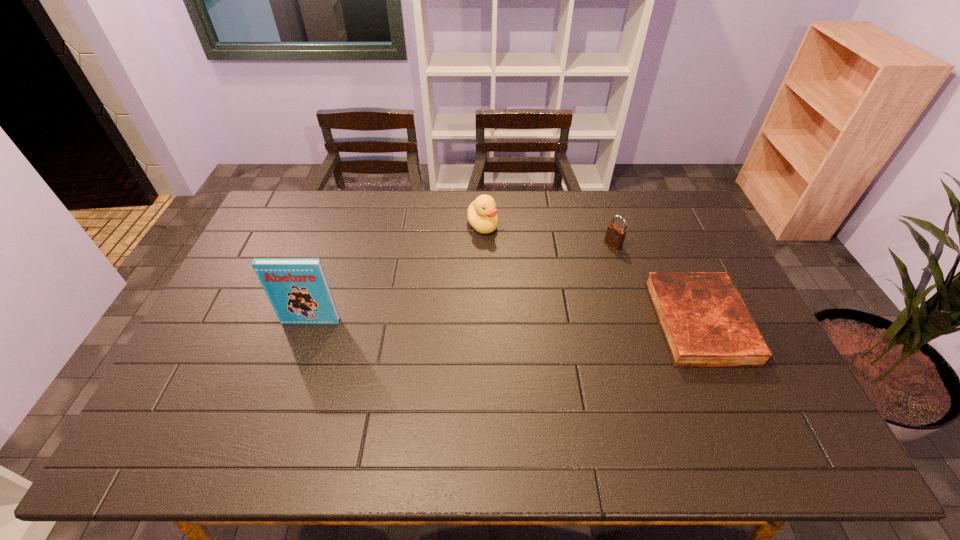
The height and width of the screenshot is (540, 960). I want to click on the leftmost object, so click(297, 288).

Locate an element on the screen. The image size is (960, 540). book is located at coordinates (297, 288).

Where is `the shortest object`? This screenshot has width=960, height=540. the shortest object is located at coordinates (705, 322).

Locate an element on the screen. the rightmost object is located at coordinates (705, 322).

Locate an element on the screen. duck is located at coordinates (482, 214).

You are a GUI agent. You are given a task and a screenshot of the screen. Output one action in this format:
    pyautogui.click(x=<x>, y=<y>)
    Task: Click on the farthest object
    
    Given the screenshot: What is the action you would take?
    pyautogui.click(x=482, y=214)

The height and width of the screenshot is (540, 960). In order to click on the third nearest object in this screenshot , I will do `click(615, 235)`.

This screenshot has height=540, width=960. What are the coordinates of `padlock` in the screenshot? It's located at (615, 235).

Locate an element on the screen. Image resolution: width=960 pixels, height=540 pixels. free space located on the front cover of the leftmost object is located at coordinates (290, 383).

Identify the location of vacant space located 0.200m at the beak of the second object from left to right. (512, 275).